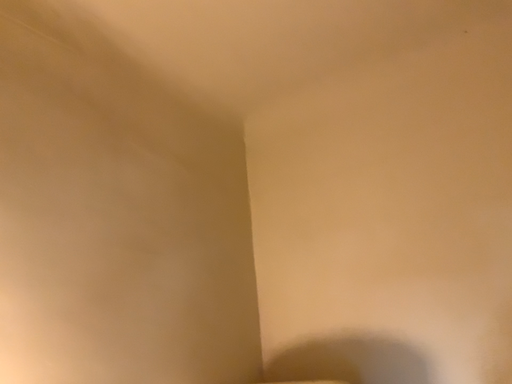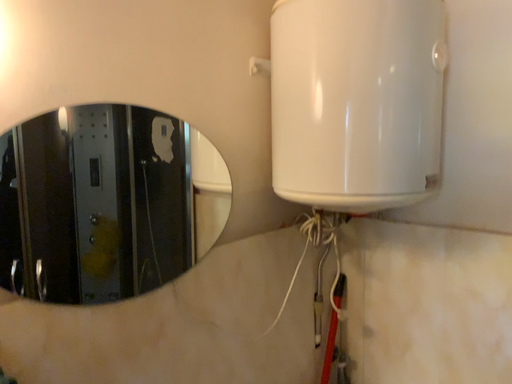
Question: How did the camera likely rotate when shooting the video?

Choices:
 (A) rotated right
 (B) rotated left

Answer: (B)